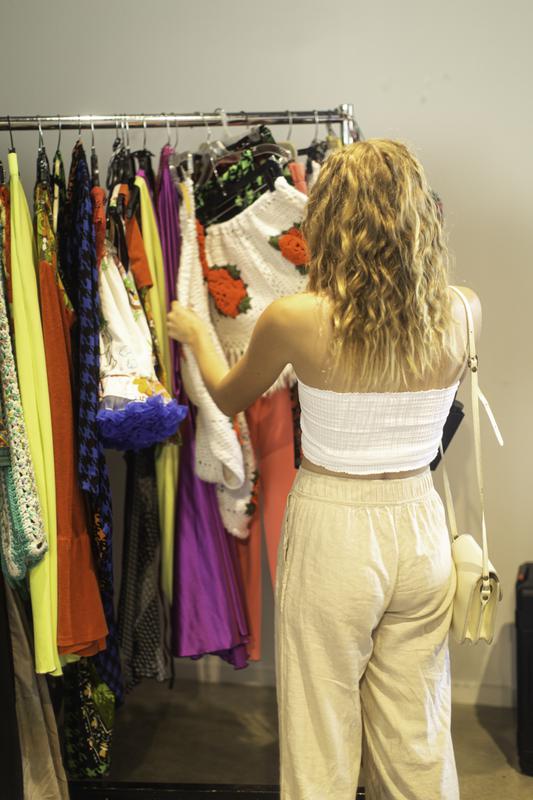
Locate an element on the screen. clothes rackblue ruffle is located at coordinates [x=128, y=118], [x=140, y=430].